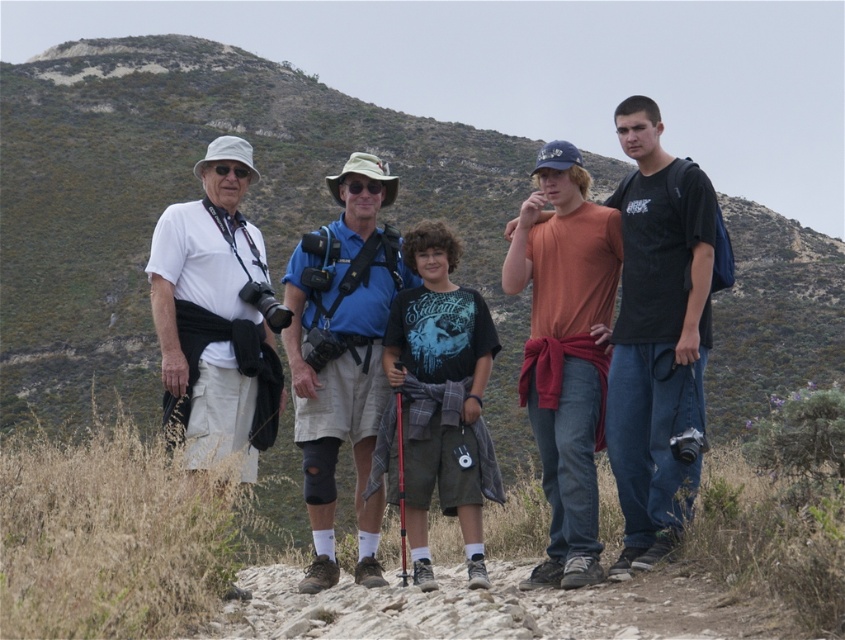
Question: Can you confirm if black cotton t-shirt at right is thinner than white matte shirt at left?

Choices:
 (A) no
 (B) yes

Answer: (B)

Question: Is black cotton t-shirt at right above dark blue t-shirt at center?

Choices:
 (A) no
 (B) yes

Answer: (B)

Question: Does matte black camera at center appear over blue fabric shirt at center?

Choices:
 (A) yes
 (B) no

Answer: (A)

Question: Which object appears closest to the camera in this image?

Choices:
 (A) blue fabric shirt at center
 (B) matte black camera at center
 (C) white matte shirt at left

Answer: (B)

Question: Among these objects, which one is farthest from the camera?

Choices:
 (A) white matte shirt at left
 (B) blue fabric shirt at center
 (C) matte black camera at center

Answer: (B)

Question: Which of the following is the farthest from the observer?

Choices:
 (A) (368, 465)
 (B) (238, 323)
 (C) (702, 412)

Answer: (A)